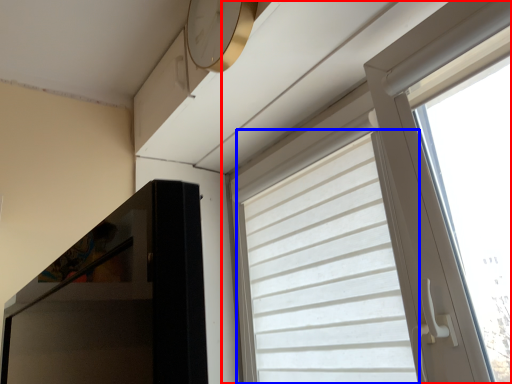
Question: Which object appears farthest to the camera in this image, window (highlighted by a red box) or curtain (highlighted by a blue box)?

Choices:
 (A) window
 (B) curtain

Answer: (B)